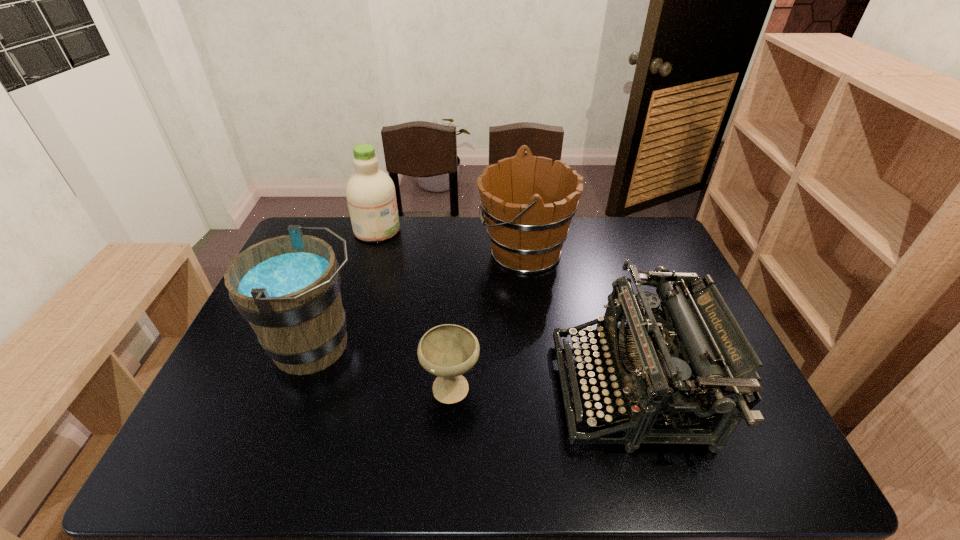
This screenshot has height=540, width=960. Find the location of `empty location between the chalice and the cleansing agent`. empty location between the chalice and the cleansing agent is located at coordinates (414, 307).

The image size is (960, 540). What are the coordinates of `vacant space in between the cleansing agent and the chalice` in the screenshot? It's located at (414, 307).

Locate an element on the screen. Image resolution: width=960 pixels, height=540 pixels. unoccupied area between the cleansing agent and the shortest object is located at coordinates (414, 307).

Image resolution: width=960 pixels, height=540 pixels. In order to click on vacant area between the farther wine bucket and the typewriter in this screenshot , I will do `click(577, 320)`.

Find the location of a particular element. empty space between the cleansing agent and the fourth tallest object is located at coordinates (503, 309).

Where is `object that stands as the fourth closest to the farther wine bucket`? This screenshot has height=540, width=960. object that stands as the fourth closest to the farther wine bucket is located at coordinates (288, 287).

Locate an element on the screen. This screenshot has height=540, width=960. object identified as the closest to the shortest object is located at coordinates (288, 287).

Where is `vacant space that satisfies the following two spatial constraints: 1. with a handle on the side of the chalice; 2. on the left side of the nearer wine bucket`? vacant space that satisfies the following two spatial constraints: 1. with a handle on the side of the chalice; 2. on the left side of the nearer wine bucket is located at coordinates (302, 385).

Identify the location of free spot that satisfies the following two spatial constraints: 1. on the front label of the cleansing agent; 2. on the right side of the chalice. (329, 385).

Find the location of a particular element. The height and width of the screenshot is (540, 960). free point that satisfies the following two spatial constraints: 1. on the front label of the shortest object; 2. on the right side of the cleansing agent is located at coordinates (329, 385).